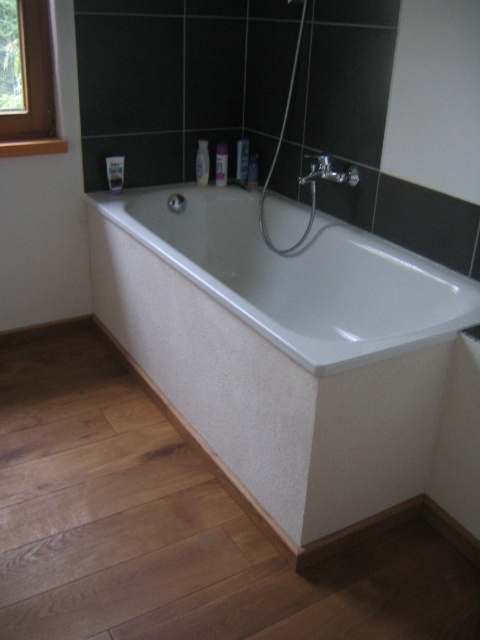
Between white textured bath at center and wooden frame at upper left, which one is positioned higher?

wooden frame at upper left is higher up.

Is white textured bath at center wider than wooden frame at upper left?

Indeed, white textured bath at center has a greater width compared to wooden frame at upper left.

Locate an element on the screen. white textured bath at center is located at coordinates (299, 356).

Is white textured bath at center thinner than matte silver faucet at upper center?

No, white textured bath at center is not thinner than matte silver faucet at upper center.

Can you confirm if white textured bath at center is positioned to the left of matte silver faucet at upper center?

Yes, white textured bath at center is to the left of matte silver faucet at upper center.

The height and width of the screenshot is (640, 480). Find the location of `white textured bath at center`. white textured bath at center is located at coordinates 299,356.

Measure the distance from wooden frame at upper left to matte silver faucet at upper center.

wooden frame at upper left and matte silver faucet at upper center are 1.19 meters apart from each other.

Based on the photo, is the position of wooden frame at upper left more distant than that of matte silver faucet at upper center?

Yes.

You are a GUI agent. You are given a task and a screenshot of the screen. Output one action in this format:
    pyautogui.click(x=<x>, y=<y>)
    Task: Click on the wooden frame at upper left
    This screenshot has height=640, width=480.
    Given the screenshot: What is the action you would take?
    pyautogui.click(x=33, y=88)

You are a GUI agent. You are given a task and a screenshot of the screen. Output one action in this format:
    pyautogui.click(x=<x>, y=<y>)
    Task: Click on the wooden frame at upper left
    The width and height of the screenshot is (480, 640).
    Given the screenshot: What is the action you would take?
    pyautogui.click(x=33, y=88)